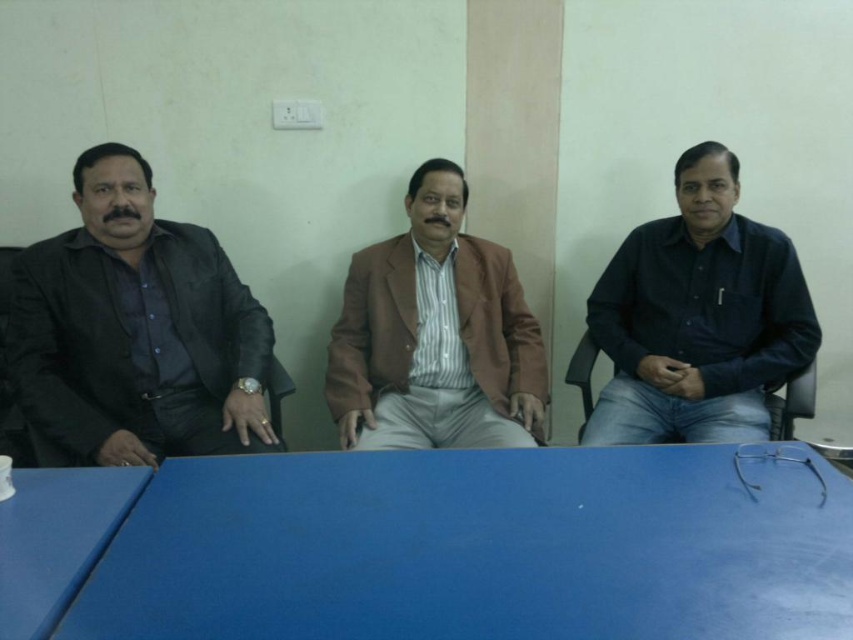
Is matte black jacket at left to the right of dark blue shirt at right from the viewer's perspective?

Incorrect, matte black jacket at left is not on the right side of dark blue shirt at right.

Which is more to the right, matte black jacket at left or dark blue shirt at right?

dark blue shirt at right is more to the right.

This screenshot has width=853, height=640. Describe the element at coordinates (136, 332) in the screenshot. I see `matte black jacket at left` at that location.

At what (x,y) coordinates should I click in order to perform the action: click on matte black jacket at left. Please return your answer as a coordinate pair (x, y). The height and width of the screenshot is (640, 853). Looking at the image, I should click on pos(136,332).

From the picture: Between dark blue shirt at right and brown textured blazer at center, which one is positioned lower?

dark blue shirt at right is below.

Based on the photo, does dark blue shirt at right have a lesser width compared to brown textured blazer at center?

No.

Locate an element on the screen. Image resolution: width=853 pixels, height=640 pixels. dark blue shirt at right is located at coordinates (698, 316).

Find the location of `blue matte table at center`. blue matte table at center is located at coordinates 480,547.

Does blue matte table at center have a lesser width compared to brown textured blazer at center?

No, blue matte table at center is not thinner than brown textured blazer at center.

Describe the element at coordinates (480, 547) in the screenshot. Image resolution: width=853 pixels, height=640 pixels. I see `blue matte table at center` at that location.

This screenshot has width=853, height=640. In order to click on blue matte table at center in this screenshot , I will do `click(480, 547)`.